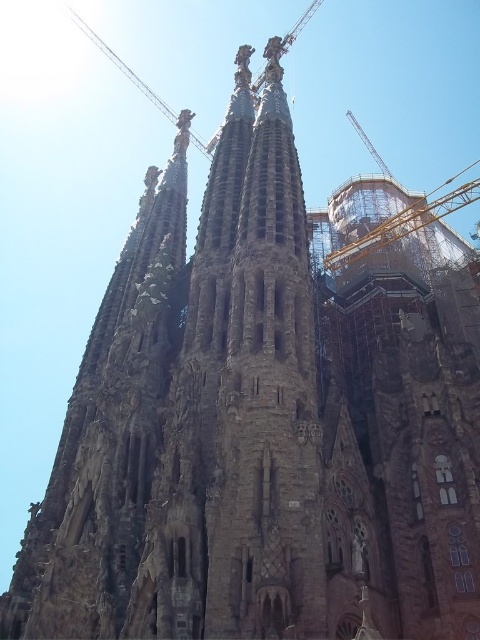
You are standing in front of the Sagrada Familia and notice two points marked on the facade. The first point is at coordinate point (441, 205) and the second is at point (320, 3). Which point is closer to you?

Point (441, 205) is closer to the viewer than point (320, 3).

You are a tourist standing at the base of the Sagrada Familia, looking up at the central spire. You notice a point marked at coordinates (407, 221). What object is located at this specific point?

The point at coordinates (407, 221) is occupied by metallic scaffolding at right.

You are a tourist standing in front of the Sagrada Familia and want to take a photo without the metallic scaffolding at right appearing in the frame. Which direction should you move to ensure the scaffolding is out of view?

The metallic scaffolding at right is located at point (407, 221). To avoid it, move to the left side of the Sagrada Familia to ensure the scaffolding is out of the frame.